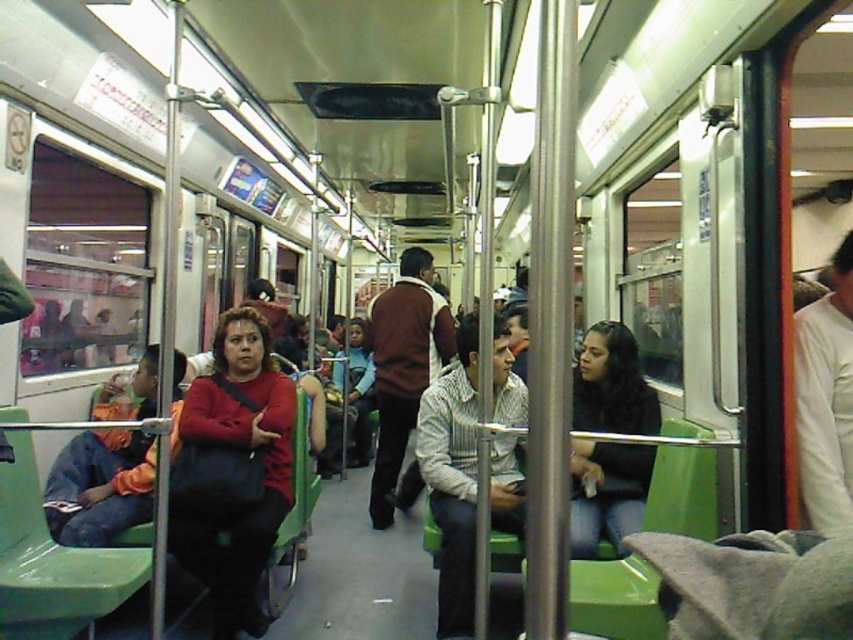
Does matte red sweater at center have a greater height compared to brown sweater at center?

Incorrect, matte red sweater at center's height is not larger of brown sweater at center's.

What do you see at coordinates (247, 452) in the screenshot? I see `matte red sweater at center` at bounding box center [247, 452].

Identify the location of matte red sweater at center. (247, 452).

You are a GUI agent. You are given a task and a screenshot of the screen. Output one action in this format:
    pyautogui.click(x=<x>, y=<y>)
    Task: Click on the matte red sweater at center
    
    Given the screenshot: What is the action you would take?
    pyautogui.click(x=247, y=452)

Can you confirm if matte red sweater at center is shorter than dark brown sweater at center?

In fact, matte red sweater at center may be taller than dark brown sweater at center.

Can you confirm if matte red sweater at center is positioned to the left of dark brown sweater at center?

Yes, matte red sweater at center is to the left of dark brown sweater at center.

Is point (227, 352) farther from camera compared to point (621, 449)?

Yes, point (227, 352) is behind point (621, 449).

The image size is (853, 640). In order to click on matte red sweater at center in this screenshot , I will do `click(247, 452)`.

Measure the distance between dark brown sweater at center and brown sweater at center.

dark brown sweater at center is 4.99 feet away from brown sweater at center.

You are a GUI agent. You are given a task and a screenshot of the screen. Output one action in this format:
    pyautogui.click(x=<x>, y=<y>)
    Task: Click on the dark brown sweater at center
    
    Given the screenshot: What is the action you would take?
    pyautogui.click(x=607, y=493)